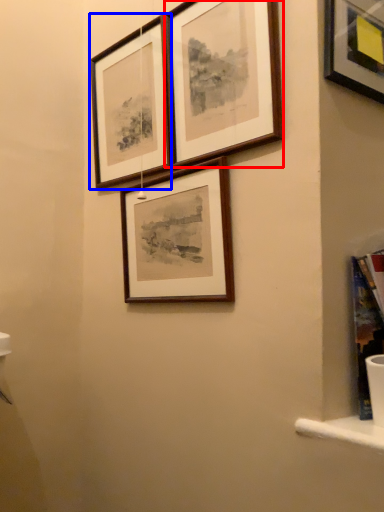
Question: Among these objects, which one is farthest to the camera, picture frame (highlighted by a red box) or picture frame (highlighted by a blue box)?

Choices:
 (A) picture frame
 (B) picture frame

Answer: (B)